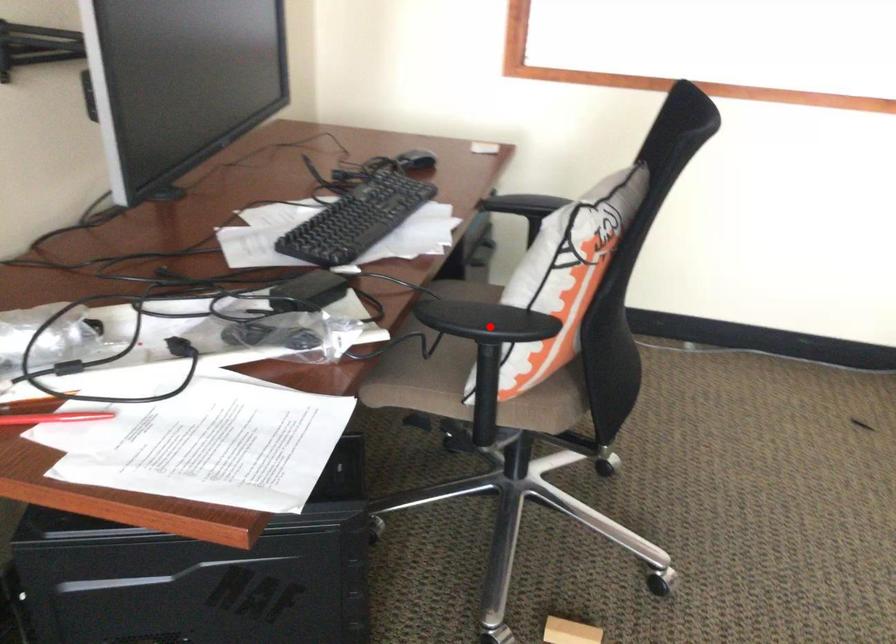
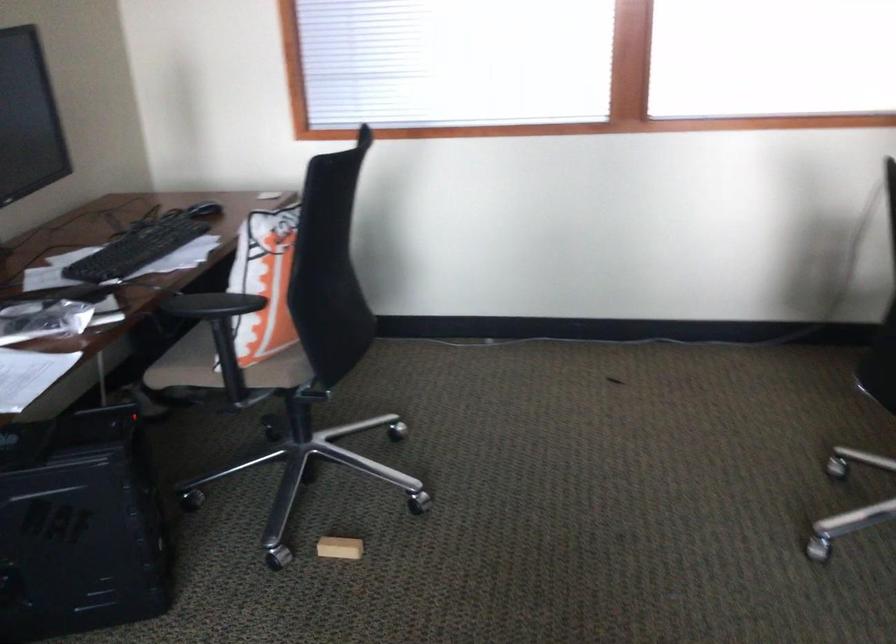
In the second image, find the point that corresponds to the highlighted location in the first image.

(211, 305)